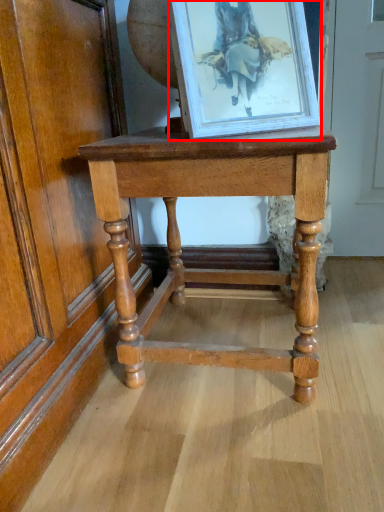
Question: Observing the image, what is the correct spatial positioning of picture frame (annotated by the red box) in reference to table?

Choices:
 (A) left
 (B) right

Answer: (B)